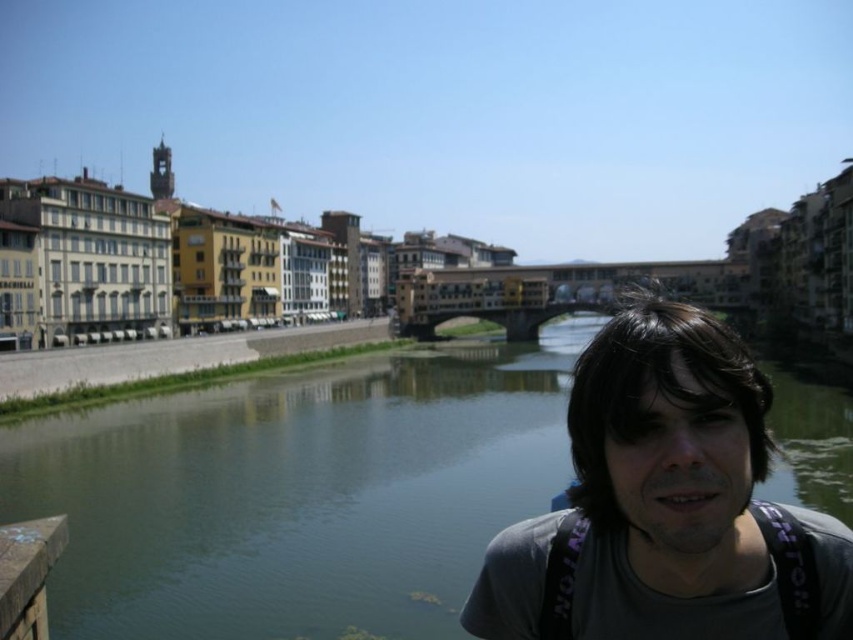
You are a photographer standing at the riverside. You notice the gray fabric shirt at center and the brown wooden rail at lower left in your viewfinder. Which object is positioned further to the right in the frame?

The gray fabric shirt at center is positioned to the right of the brown wooden rail at lower left, so it is further to the right in the frame.

You are a photographer standing at the position of the person in the image. You want to capture a reflection of the Ponte Vecchio bridge in the green water at center. However, your camera is on a tripod placed at the location of the gray fabric shirt at center. Can you adjust the tripod to get the reflection without moving your current position?

The distance between the green water at center and the gray fabric shirt at center is 50.08 meters. Since the camera is on the tripod at the gray fabric shirt at center, which is far away from the green water at center, you cannot adjust the tripod to capture the reflection without moving your position.